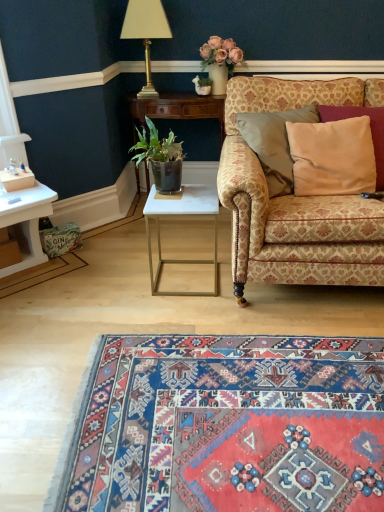
Where is `free point to the right of white marble table at center, the 1th table viewed from the front`? free point to the right of white marble table at center, the 1th table viewed from the front is located at coordinates tap(250, 297).